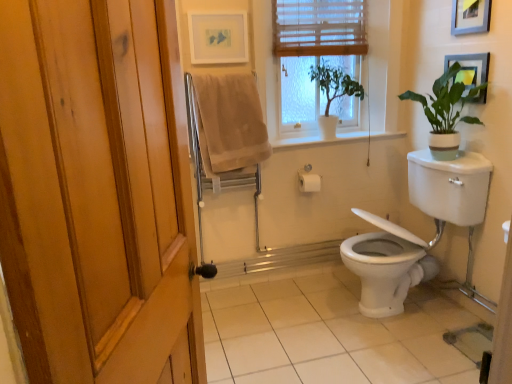
Question: Do you think beige cotton towel at upper center is within white tile at lower center, or outside of it?

Choices:
 (A) outside
 (B) inside

Answer: (A)

Question: From a real-world perspective, is beige cotton towel at upper center physically located above or below white tile at lower center?

Choices:
 (A) above
 (B) below

Answer: (A)

Question: Considering the real-world distances, which object is closest to the wooden picture frame at upper right, which is the 2th picture frame from left to right?

Choices:
 (A) green matte plant at upper center, the second houseplant from the right
 (B) wooden blinds at upper center
 (C) wooden blinds at upper center
 (D) beige cotton towel at upper center
 (E) metallic silver picture frame at upper right, acting as the 1th picture frame starting from the right

Answer: (E)

Question: Which object is positioned farthest from the green matte plant at upper center, the second houseplant from the right?

Choices:
 (A) beige cotton towel at upper center
 (B) white glossy toilet at lower right
 (C) wooden picture frame at upper right, which is the 2th picture frame from left to right
 (D) matte white picture frame at upper center, the 3th picture frame when ordered from right to left
 (E) wooden blinds at upper center

Answer: (B)